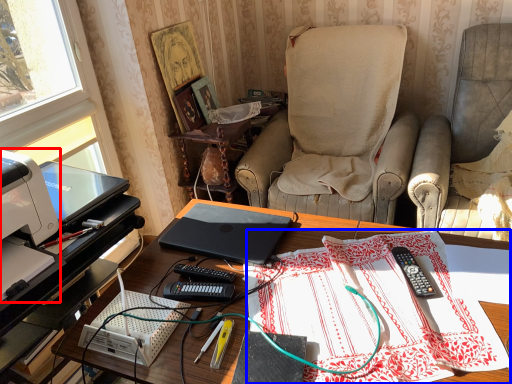
Question: Which object appears farthest to the camera in this image, printer (highlighted by a red box) or tablecloth (highlighted by a blue box)?

Choices:
 (A) printer
 (B) tablecloth

Answer: (A)